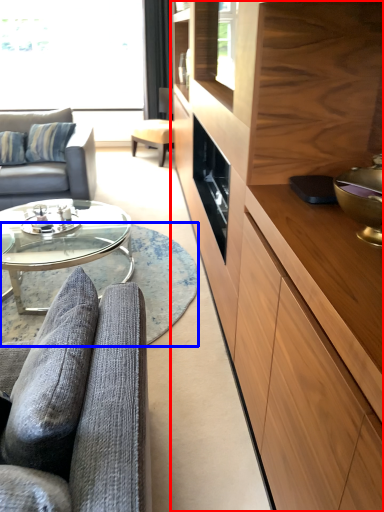
Question: Which of the following is the closest to the observer, cabinetry (highlighted by a red box) or plain (highlighted by a blue box)?

Choices:
 (A) cabinetry
 (B) plain

Answer: (A)